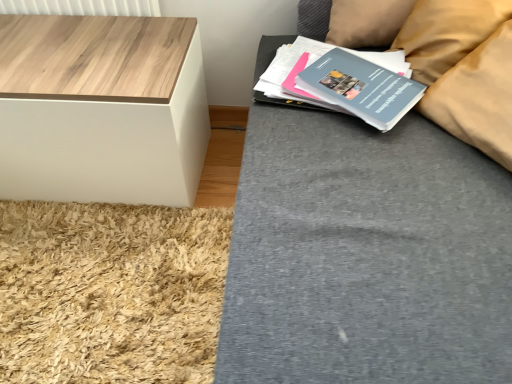
Where is `free space above wooden white cube at left (from a real-world perspective)`? free space above wooden white cube at left (from a real-world perspective) is located at coordinates (89, 53).